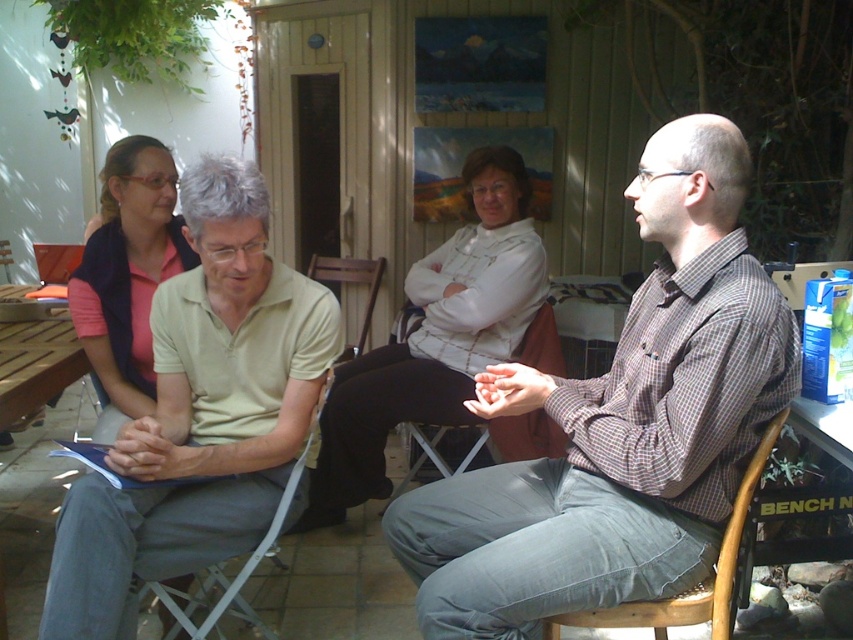
Question: Which object is positioned farthest from the wooden at left?

Choices:
 (A) wooden chair at center
 (B) metallic gray chair at center

Answer: (A)

Question: Among these points, which one is nearest to the camera?

Choices:
 (A) (786, 364)
 (B) (151, 305)
 (C) (335, 272)

Answer: (A)

Question: Can you confirm if wooden at right is bigger than metallic silver chair at center?

Choices:
 (A) yes
 (B) no

Answer: (B)

Question: Is checkered fabric shirt at center positioned before metallic gray chair at center?

Choices:
 (A) no
 (B) yes

Answer: (B)

Question: Which of the following is the closest to the observer?

Choices:
 (A) metallic gray chair at center
 (B) metallic silver chair at center

Answer: (A)

Question: Is wooden at right closer to camera compared to metallic gray chair at center?

Choices:
 (A) yes
 (B) no

Answer: (A)